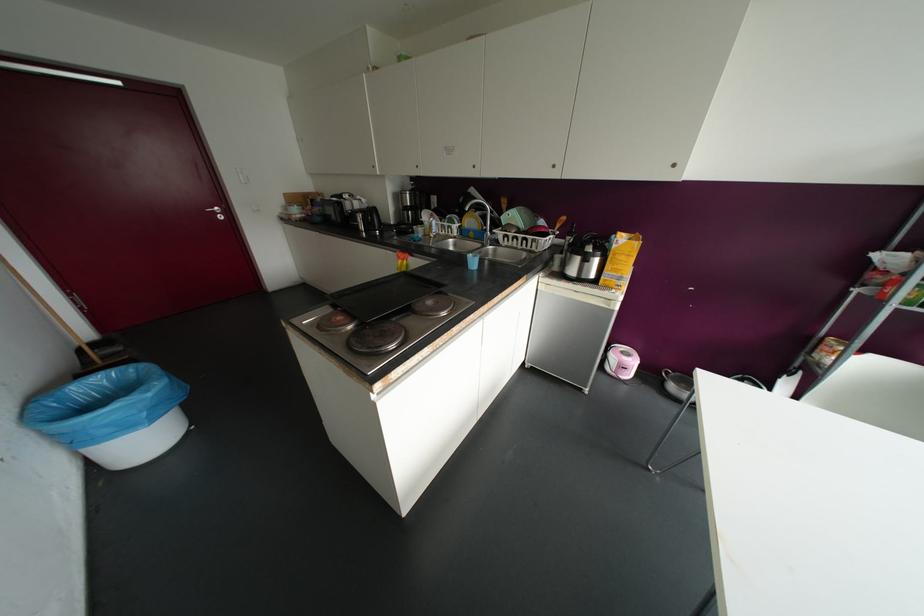
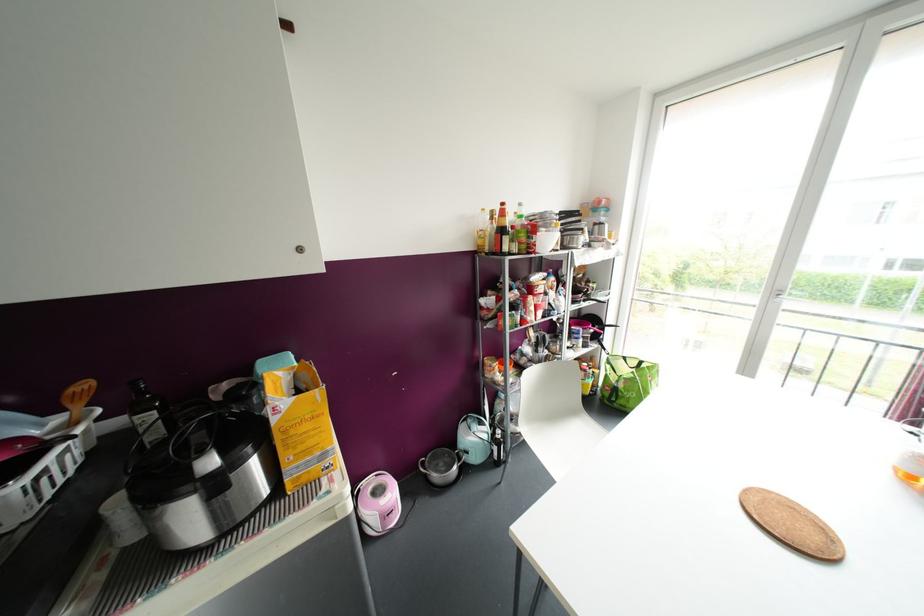
The point at [633,361] is marked in the first image. Where is the corresponding point in the second image?

(392, 493)